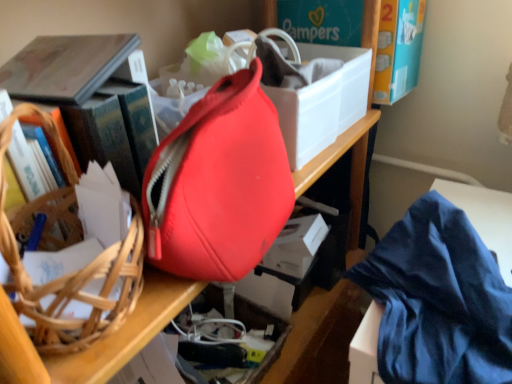
Question: Considering the relative sizes of matte red bag at center and blue silky cloth at lower right in the image provided, is matte red bag at center taller than blue silky cloth at lower right?

Choices:
 (A) yes
 (B) no

Answer: (A)

Question: From the image's perspective, is matte red bag at center beneath blue silky cloth at lower right?

Choices:
 (A) no
 (B) yes

Answer: (A)

Question: From the image's perspective, is matte red bag at center on blue silky cloth at lower right?

Choices:
 (A) no
 (B) yes

Answer: (B)

Question: Can we say matte red bag at center lies outside blue silky cloth at lower right?

Choices:
 (A) no
 (B) yes

Answer: (B)

Question: Considering the relative positions of matte red bag at center and blue silky cloth at lower right in the image provided, is matte red bag at center in front of blue silky cloth at lower right?

Choices:
 (A) no
 (B) yes

Answer: (B)

Question: From a real-world perspective, is matte red bag at center on blue silky cloth at lower right?

Choices:
 (A) no
 (B) yes

Answer: (B)

Question: Can you confirm if hardcover book at left is positioned to the left of white matte storage box at center?

Choices:
 (A) yes
 (B) no

Answer: (A)

Question: Does hardcover book at left have a larger size compared to white matte storage box at center?

Choices:
 (A) no
 (B) yes

Answer: (B)

Question: From a real-world perspective, is hardcover book at left on top of white matte storage box at center?

Choices:
 (A) yes
 (B) no

Answer: (A)

Question: Is hardcover book at left smaller than white matte storage box at center?

Choices:
 (A) no
 (B) yes

Answer: (A)

Question: Is hardcover book at left positioned before white matte storage box at center?

Choices:
 (A) yes
 (B) no

Answer: (A)

Question: Does hardcover book at left have a greater width compared to white matte storage box at center?

Choices:
 (A) no
 (B) yes

Answer: (B)

Question: From a real-world perspective, is brown woven basket at left beneath white matte storage box at center?

Choices:
 (A) no
 (B) yes

Answer: (A)